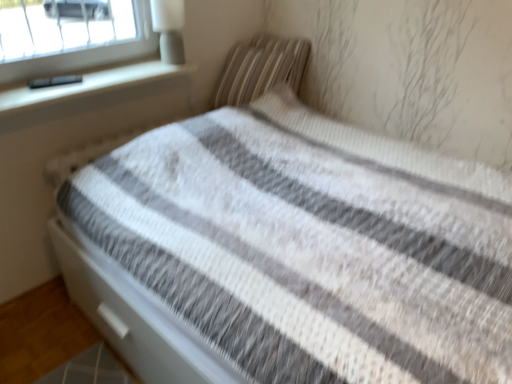
Question: Considering the relative positions of striped fabric pillow at upper right and white matte lamp at upper left in the image provided, is striped fabric pillow at upper right behind white matte lamp at upper left?

Choices:
 (A) no
 (B) yes

Answer: (B)

Question: Considering the relative sizes of striped fabric pillow at upper right and white matte lamp at upper left in the image provided, is striped fabric pillow at upper right thinner than white matte lamp at upper left?

Choices:
 (A) yes
 (B) no

Answer: (B)

Question: Is the position of striped fabric pillow at upper right less distant than that of white matte lamp at upper left?

Choices:
 (A) no
 (B) yes

Answer: (A)

Question: From a real-world perspective, is striped fabric pillow at upper right physically above white matte lamp at upper left?

Choices:
 (A) yes
 (B) no

Answer: (B)

Question: Can you confirm if striped fabric pillow at upper right is bigger than white matte lamp at upper left?

Choices:
 (A) yes
 (B) no

Answer: (A)

Question: From a real-world perspective, is striped fabric pillow at upper right beneath white matte lamp at upper left?

Choices:
 (A) no
 (B) yes

Answer: (B)

Question: From a real-world perspective, is white matte lamp at upper left beneath striped fabric pillow at upper right?

Choices:
 (A) no
 (B) yes

Answer: (A)

Question: Is white matte lamp at upper left to the right of striped fabric pillow at upper right from the viewer's perspective?

Choices:
 (A) no
 (B) yes

Answer: (A)

Question: Is there a large distance between white matte lamp at upper left and striped fabric pillow at upper right?

Choices:
 (A) no
 (B) yes

Answer: (A)

Question: Does white matte lamp at upper left have a lesser width compared to striped fabric pillow at upper right?

Choices:
 (A) no
 (B) yes

Answer: (B)

Question: From a real-world perspective, is white matte lamp at upper left physically above striped fabric pillow at upper right?

Choices:
 (A) no
 (B) yes

Answer: (B)

Question: Could you tell me if white matte lamp at upper left is facing striped fabric pillow at upper right?

Choices:
 (A) no
 (B) yes

Answer: (A)

Question: Is point (158, 8) positioned closer to the camera than point (284, 38)?

Choices:
 (A) closer
 (B) farther

Answer: (A)